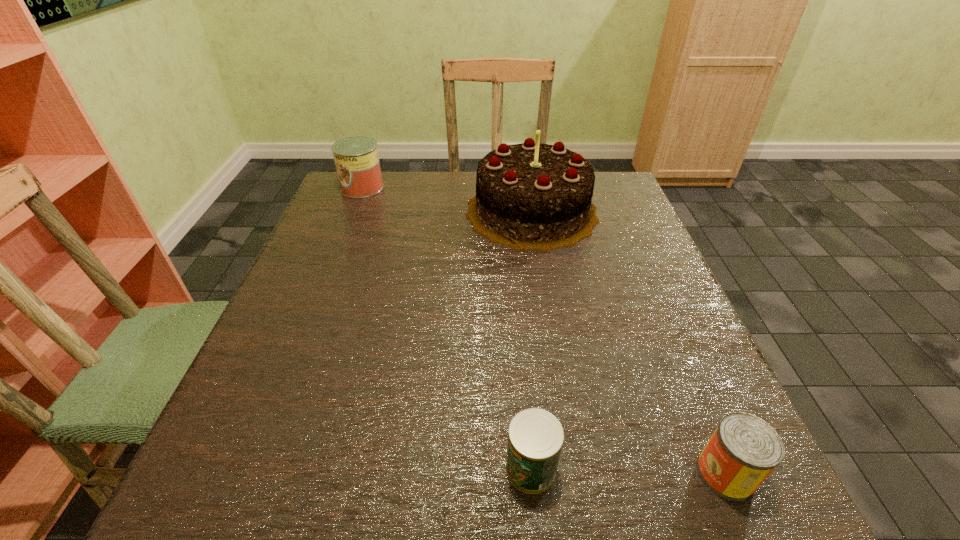
What are the coordinates of `free point between the rightmost can and the second can from left to right` in the screenshot? It's located at (628, 471).

Find the location of a particular element. The image size is (960, 540). free spot between the tallest can and the rightmost object is located at coordinates (544, 330).

Locate an element on the screen. This screenshot has height=540, width=960. vacant region between the birthday cake and the rightmost can is located at coordinates (629, 342).

Where is `object that stands as the second closest to the rightmost can`? The height and width of the screenshot is (540, 960). object that stands as the second closest to the rightmost can is located at coordinates (529, 196).

What are the coordinates of `object that can be found as the third closest to the rightmost object` in the screenshot? It's located at (356, 158).

Choose which can is the nearest neighbor to the rightmost object. Please provide its 2D coordinates. Your answer should be formatted as a tuple, i.e. [(x, y)], where the tuple contains the x and y coordinates of a point satisfying the conditions above.

[(535, 438)]

This screenshot has width=960, height=540. I want to click on the closest can relative to the second can from left to right, so click(x=744, y=449).

Locate an element on the screen. The image size is (960, 540). free space in the image that satisfies the following two spatial constraints: 1. on the front side of the rightmost can; 2. on the right side of the leftmost object is located at coordinates (249, 474).